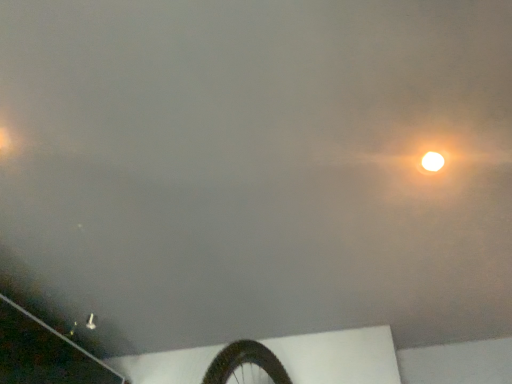
The height and width of the screenshot is (384, 512). Describe the element at coordinates (432, 160) in the screenshot. I see `bright white orb at upper right` at that location.

Locate an element on the screen. This screenshot has width=512, height=384. bright white orb at upper right is located at coordinates (432, 160).

At what (x,y) coordinates should I click in order to perform the action: click on bright white orb at upper right. Please return your answer as a coordinate pair (x, y). This screenshot has height=384, width=512. Looking at the image, I should click on (432, 160).